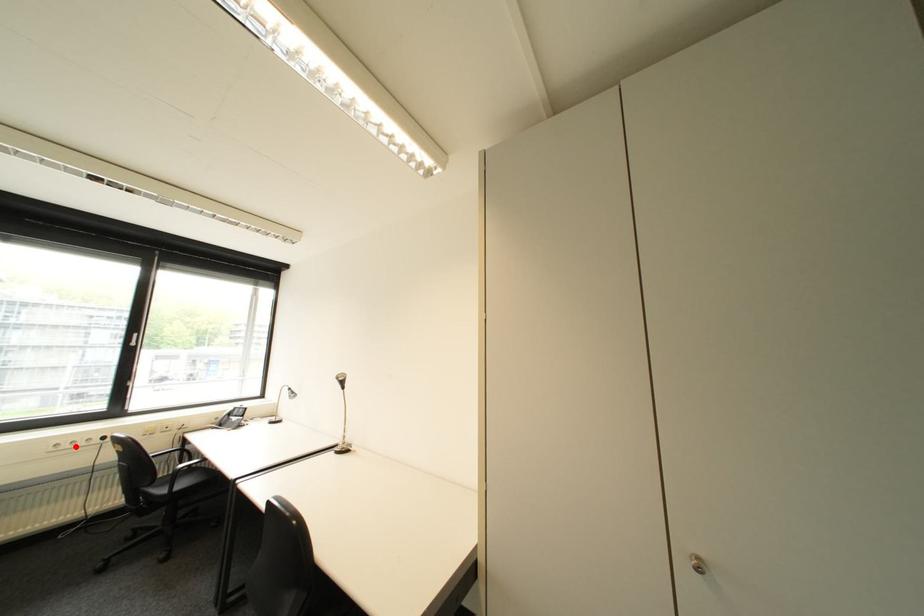
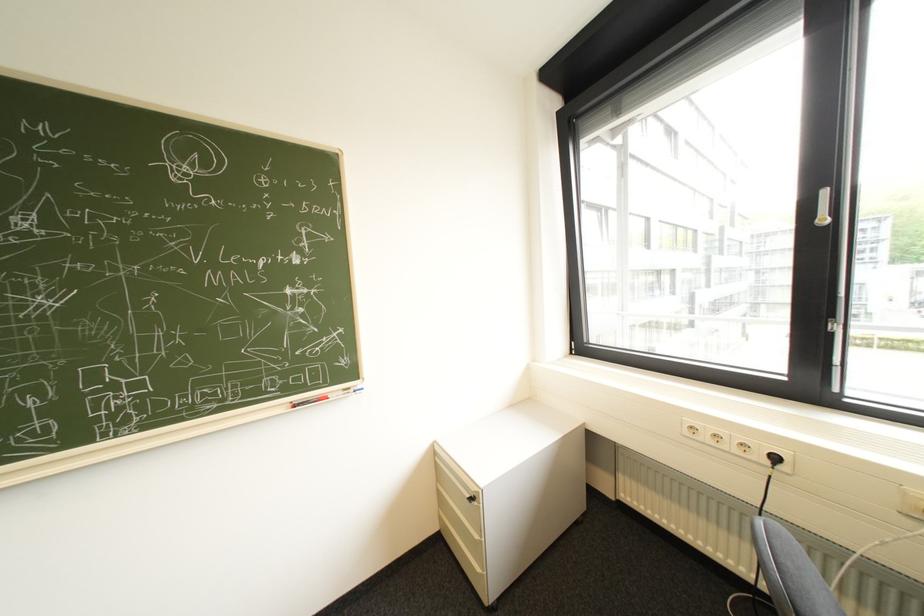
Question: I am providing you with two images of the same scene from different viewpoints. Image1 has a red point marked. In image2, the corresponding 3D location appears at what relative position? Reply with the corresponding letter.

Choices:
 (A) Closer
 (B) Farther

Answer: (B)